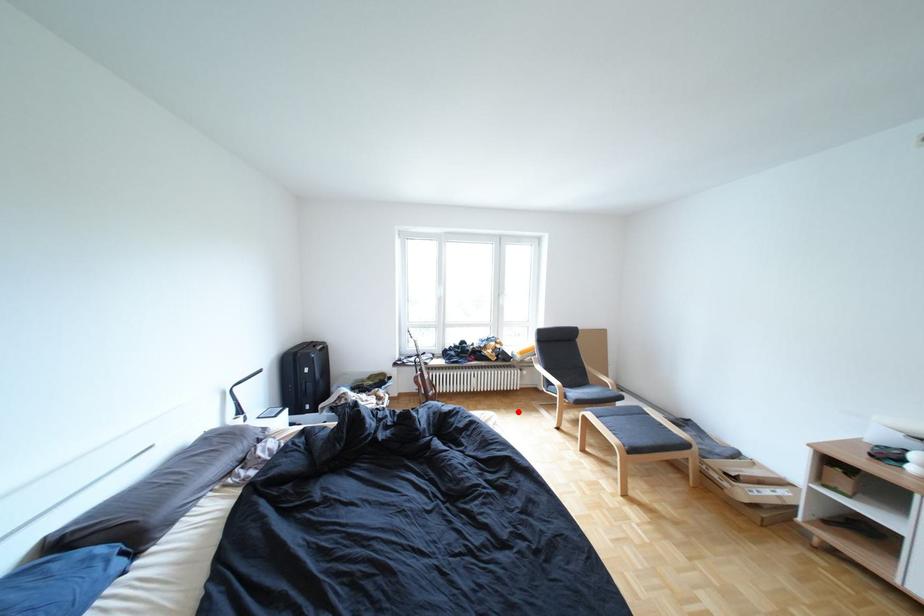
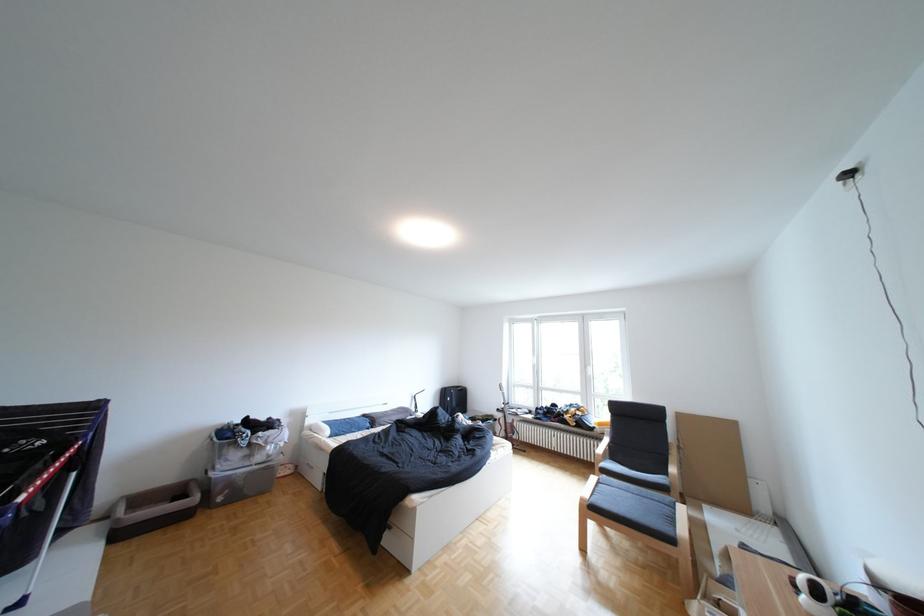
Find the pixel in the second image that matches the highlighted location in the first image.

(584, 474)